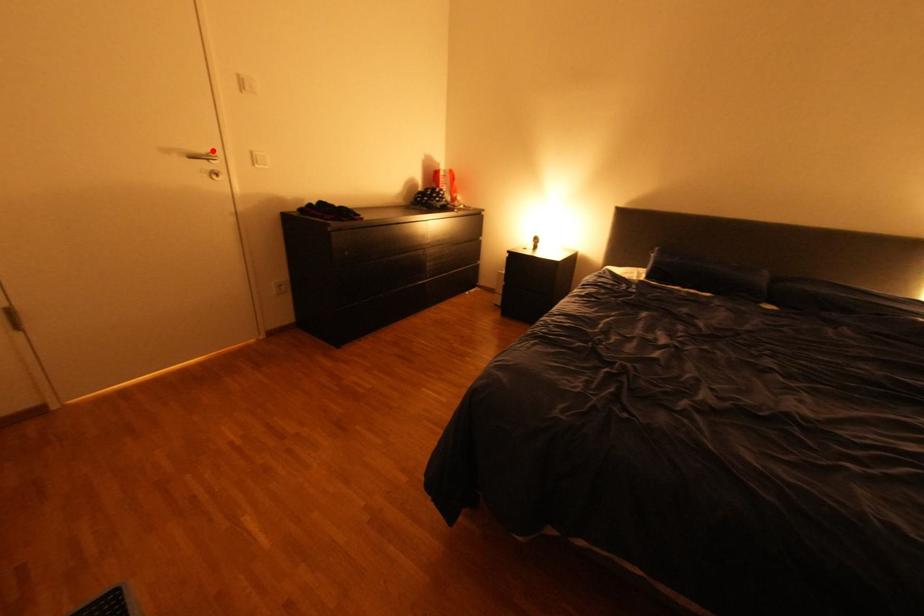
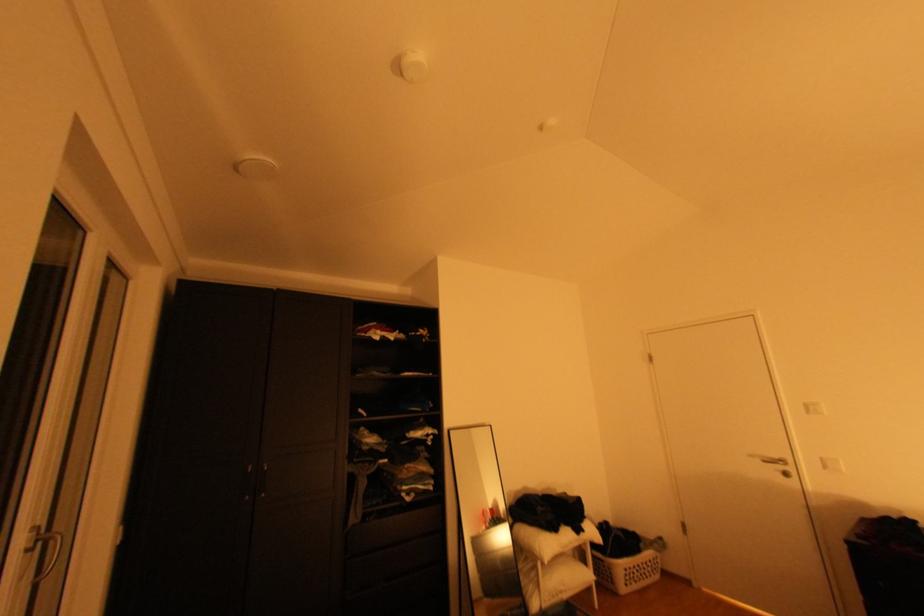
Locate, in the second image, the point that corresponds to the highlighted location in the first image.

(786, 456)